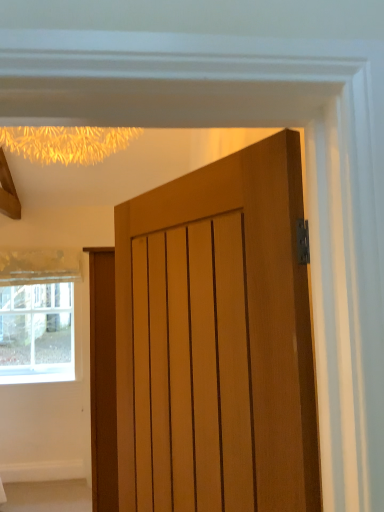
This screenshot has height=512, width=384. In order to click on clear glass window at lower left in this screenshot , I will do `click(37, 314)`.

In order to face clear glass window at lower left, should I rotate leftwards or rightwards?

To align with it, rotate left about 20.010°.

Describe the element at coordinates (37, 314) in the screenshot. I see `clear glass window at lower left` at that location.

Describe the element at coordinates (246, 309) in the screenshot. I see `wooden door at center` at that location.

This screenshot has height=512, width=384. I want to click on wooden door at center, so click(x=246, y=309).

Where is `clear glass window at lower left`? clear glass window at lower left is located at coordinates (37, 314).

Considering the positions of objects clear glass window at lower left and wooden door at center in the image provided, who is more to the left, clear glass window at lower left or wooden door at center?

clear glass window at lower left is more to the left.

In the scene shown: Is clear glass window at lower left behind wooden door at center?

Yes, clear glass window at lower left is further from the viewer.

Looking at this image, which is closer to the camera, [36,378] or [283,376]?

Positioned in front is point [283,376].

From the image's perspective, which is below, clear glass window at lower left or wooden door at center?

From the image's view, clear glass window at lower left is below.

From a real-world perspective, is clear glass window at lower left above or below wooden door at center?

In terms of real-world spatial position, clear glass window at lower left is below wooden door at center.

Considering the sizes of objects clear glass window at lower left and wooden door at center in the image provided, who is wider, clear glass window at lower left or wooden door at center?

wooden door at center.

Can you confirm if clear glass window at lower left is taller than wooden door at center?

Incorrect, the height of clear glass window at lower left is not larger of that of wooden door at center.

Considering the relative sizes of clear glass window at lower left and wooden door at center in the image provided, is clear glass window at lower left bigger than wooden door at center?

Incorrect, clear glass window at lower left is not larger than wooden door at center.

Is clear glass window at lower left not within wooden door at center?

clear glass window at lower left is positioned outside wooden door at center.

Is there a large distance between clear glass window at lower left and wooden door at center?

clear glass window at lower left is far away from wooden door at center.

Is wooden door at center at the back of clear glass window at lower left?

A: No.

What's the angular difference between clear glass window at lower left and wooden door at center's facing directions?

The angle between the facing direction of clear glass window at lower left and the facing direction of wooden door at center is 62.3 degrees.

How far apart are clear glass window at lower left and wooden door at center?

clear glass window at lower left and wooden door at center are 3.26 meters apart from each other.

In the image, there is a wooden door at center. Where is `window below it (from a real-world perspective)`? This screenshot has height=512, width=384. window below it (from a real-world perspective) is located at coordinates (37, 314).

Is wooden door at center at the left side of clear glass window at lower left?

In fact, wooden door at center is to the right of clear glass window at lower left.

Between wooden door at center and clear glass window at lower left, which one is positioned in front?

Positioned in front is wooden door at center.

Does point (309, 462) come behind point (38, 279)?

No.

From the image's perspective, is wooden door at center on clear glass window at lower left?

Yes.

From a real-world perspective, which object rests below the other?

clear glass window at lower left.

Does wooden door at center have a greater width compared to clear glass window at lower left?

Yes, wooden door at center is wider than clear glass window at lower left.

Considering the relative sizes of wooden door at center and clear glass window at lower left in the image provided, is wooden door at center shorter than clear glass window at lower left?

In fact, wooden door at center may be taller than clear glass window at lower left.

Consider the image. Is wooden door at center smaller than clear glass window at lower left?

No.

From the picture: Is wooden door at center not within clear glass window at lower left?

Absolutely, wooden door at center is external to clear glass window at lower left.

Can you see wooden door at center touching clear glass window at lower left?

No, wooden door at center is not next to clear glass window at lower left.

Is clear glass window at lower left at the back of wooden door at center?

No, wooden door at center is not facing away from clear glass window at lower left.

What's the angular difference between wooden door at center and clear glass window at lower left's facing directions?

wooden door at center and clear glass window at lower left are facing 62.3 degrees away from each other.

This screenshot has width=384, height=512. Identify the location of door above the clear glass window at lower left (from the image's perspective). (246, 309).

Locate an element on the screen. This screenshot has width=384, height=512. window on the left of wooden door at center is located at coordinates (37, 314).

Locate an element on the screen. door in front of the clear glass window at lower left is located at coordinates (246, 309).